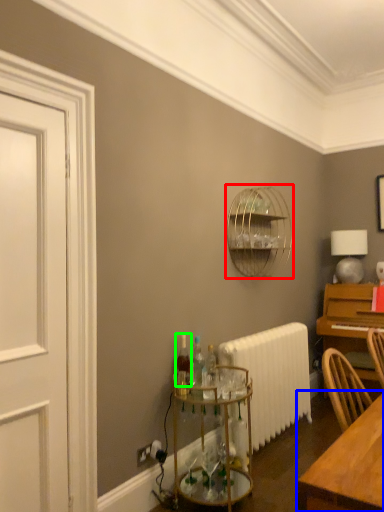
Question: Estimate the real-world distances between objects in this image. Which object is farther from bird cage (highlighted by a red box), table (highlighted by a blue box) or bottle (highlighted by a green box)?

Choices:
 (A) table
 (B) bottle

Answer: (A)